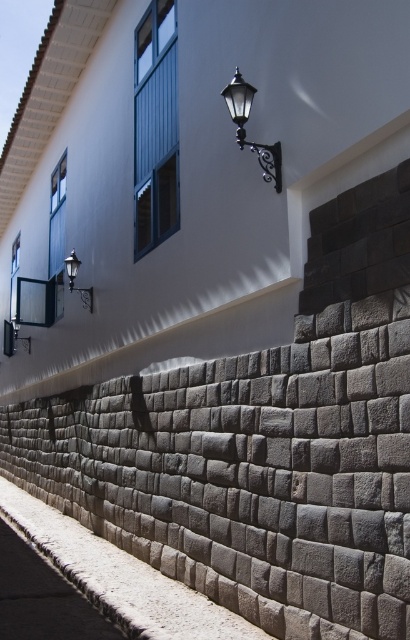
You are a maintenance worker needing to reach the polished brass lantern at upper center from the gray stone pavement at lower left. The ladder you have is 5 meters long. Can you safely reach the lantern using this ladder?

The distance between the gray stone pavement at lower left and the polished brass lantern at upper center is 5.44 meters. Since the ladder is only 5 meters long, it is not long enough to safely reach the lantern.

You are an interior designer assessing the lighting in this building. You notice the polished brass lantern at upper center and the matte black lamp at upper left. Which of these two fixtures is smaller in size?

The polished brass lantern at upper center has a smaller size compared to the matte black lamp at upper left, so the polished brass lantern at upper center is the smaller one.

You are standing in front of the building and notice the gray stone pavement at lower left and the polished brass lantern at upper center. Which object is positioned to the left of the other?

The gray stone pavement at lower left is to the left of the polished brass lantern at upper center.